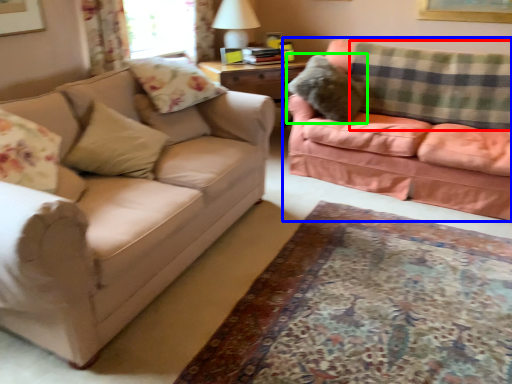
Question: Estimate the real-world distances between objects in this image. Which object is closer to plaid (highlighted by a red box), studio couch (highlighted by a blue box) or pillow (highlighted by a green box)?

Choices:
 (A) studio couch
 (B) pillow

Answer: (A)